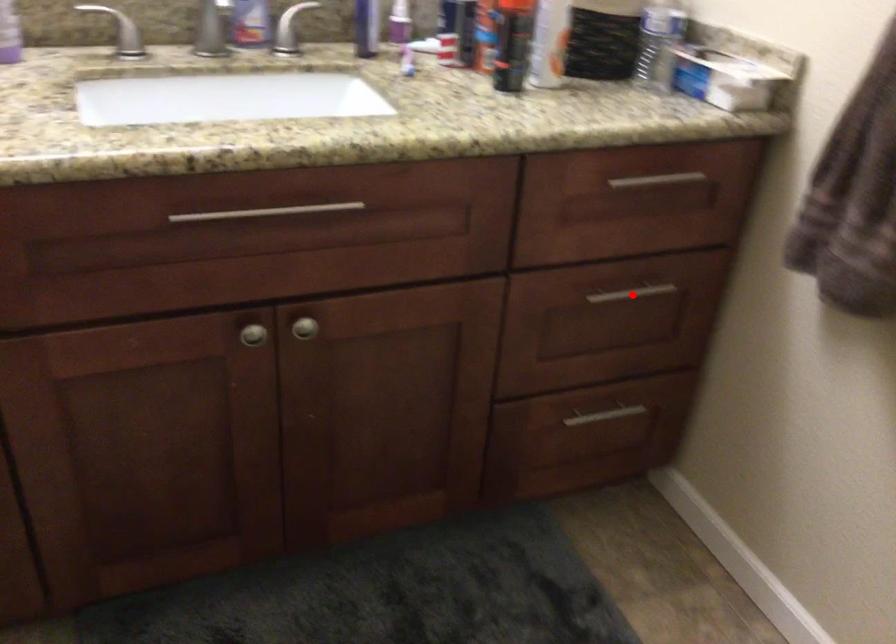
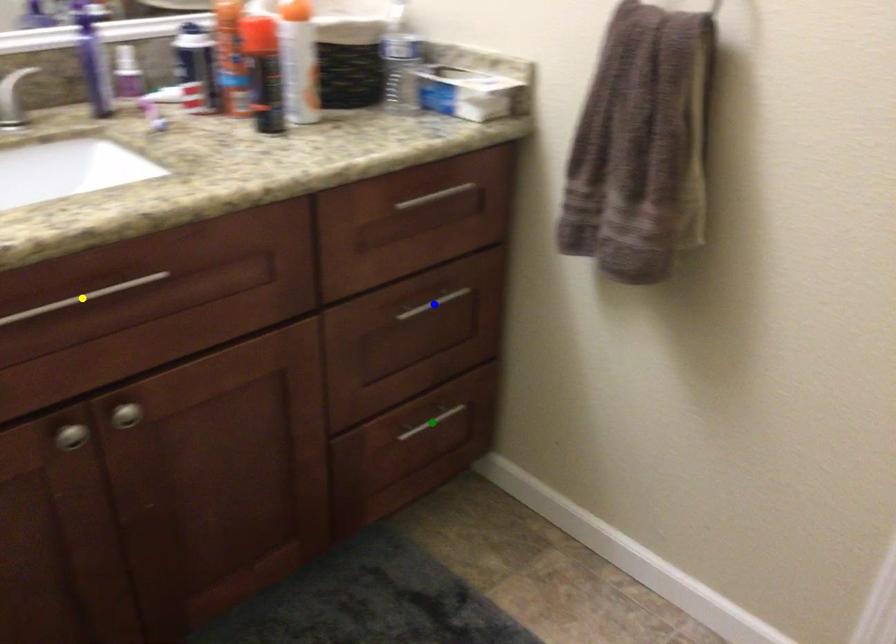
Question: I am providing you with two images of the same scene from different viewpoints. A red point is marked on the first image. You are given multiple points on the second image. Which point in image 2 represents the same 3d spot as the red point in image 1?

Choices:
 (A) blue point
 (B) yellow point
 (C) green point

Answer: (A)